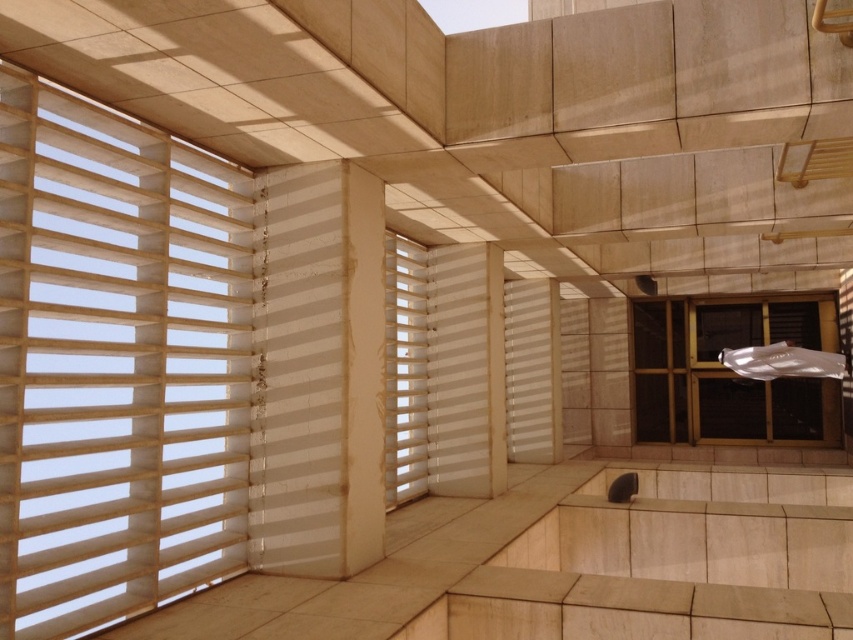
You are standing in the room and want to move from the point at coordinates point (x=758, y=314) to the point at coordinates point (x=392, y=412). Which direction should you move to get closer to your destination?

You should move downward and to the right because point (x=392, y=412) is located lower and to the right compared to point (x=758, y=314).

You are standing in the center of the room and want to look out through the matte black window at right. In which direction should you turn your head to face the window?

Since the matte black window at right is located at point (726, 372), you should turn your head to the right to face it.